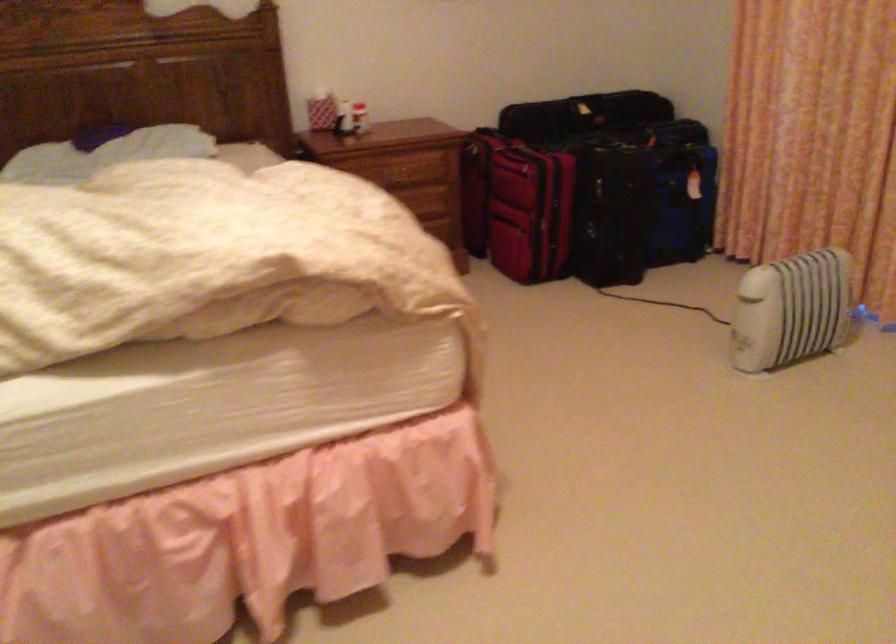
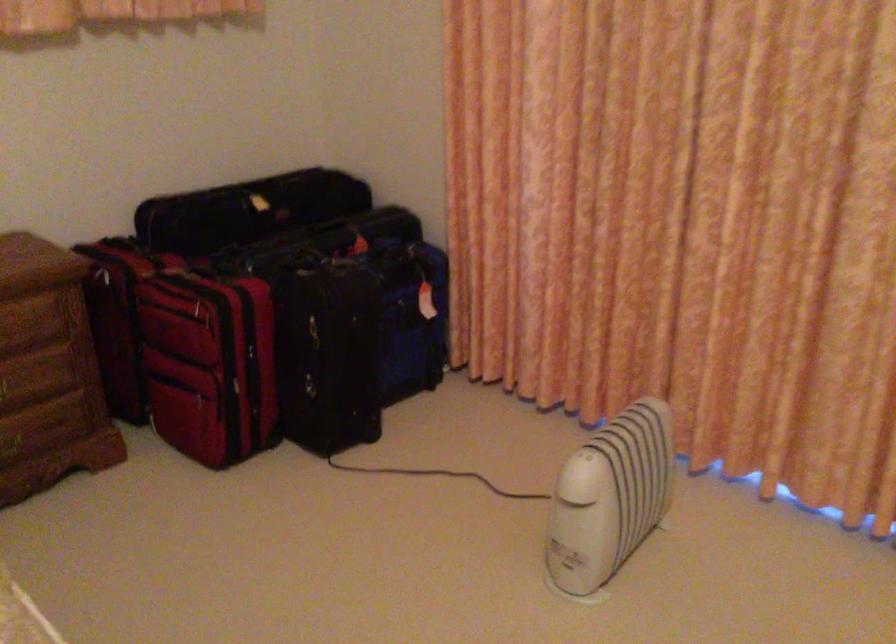
The point at (548, 156) is marked in the first image. Where is the corresponding point in the second image?

(243, 292)